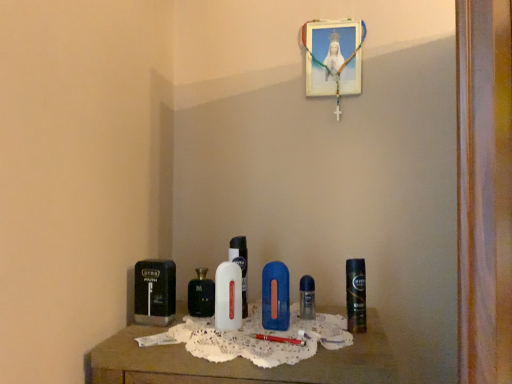
Identify the location of free space that is in between white glossy bottle at center, the third perfume positioned from the right, and matte black perfume at center, positioned as the 4th perfume in right-to-left order. (203, 323).